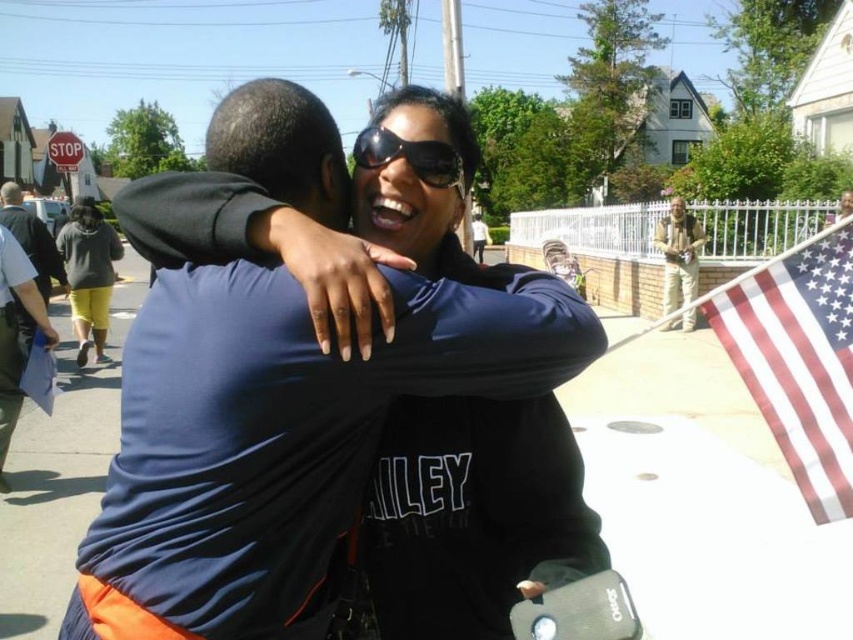
Question: Which object appears closest to the camera in this image?

Choices:
 (A) yellow cotton shorts at lower left
 (B) sunglasses at center

Answer: (B)

Question: Is american flag at right smaller than dark blue shirt at center?

Choices:
 (A) yes
 (B) no

Answer: (A)

Question: Is matte black skateboard at center below red plastic stop sign at upper left?

Choices:
 (A) no
 (B) yes

Answer: (B)

Question: Which point is farther to the camera?

Choices:
 (A) (119, 250)
 (B) (67, 161)
 (C) (4, 209)
 (D) (728, 304)

Answer: (B)

Question: Can you confirm if matte black skateboard at center is positioned below american flag at right?

Choices:
 (A) yes
 (B) no

Answer: (A)

Question: Which is nearer to the american flag at right?

Choices:
 (A) matte black skateboard at center
 (B) tan/leather jacket at upper right
 (C) dark blue shirt at center

Answer: (A)